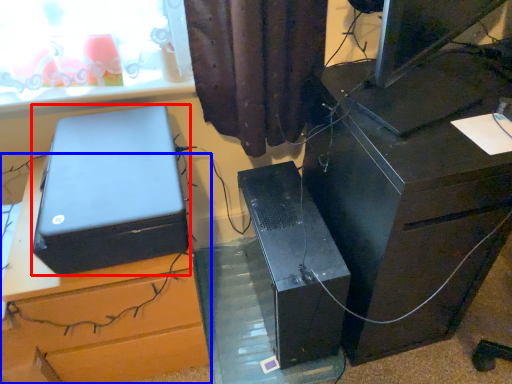
Question: Which point is further to the camera, box (highlighted by a red box) or furniture (highlighted by a blue box)?

Choices:
 (A) box
 (B) furniture

Answer: (B)